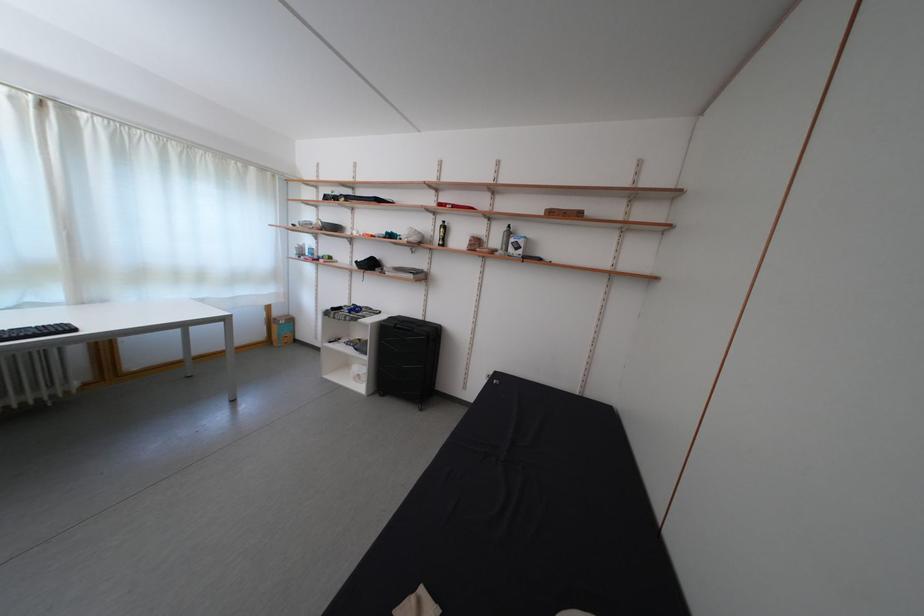
The location [505,238] corresponds to which object?

This point indicates the green pump bottle.